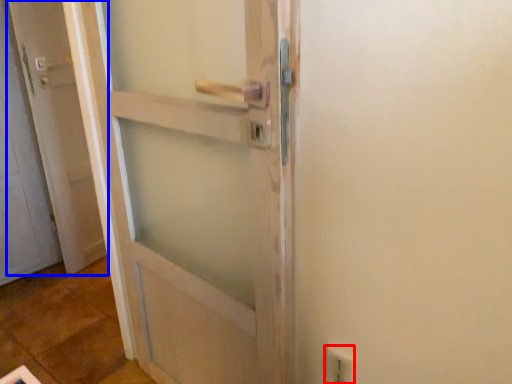
Question: Which object appears farthest to the camera in this image, electric outlet (highlighted by a red box) or door (highlighted by a blue box)?

Choices:
 (A) electric outlet
 (B) door

Answer: (B)